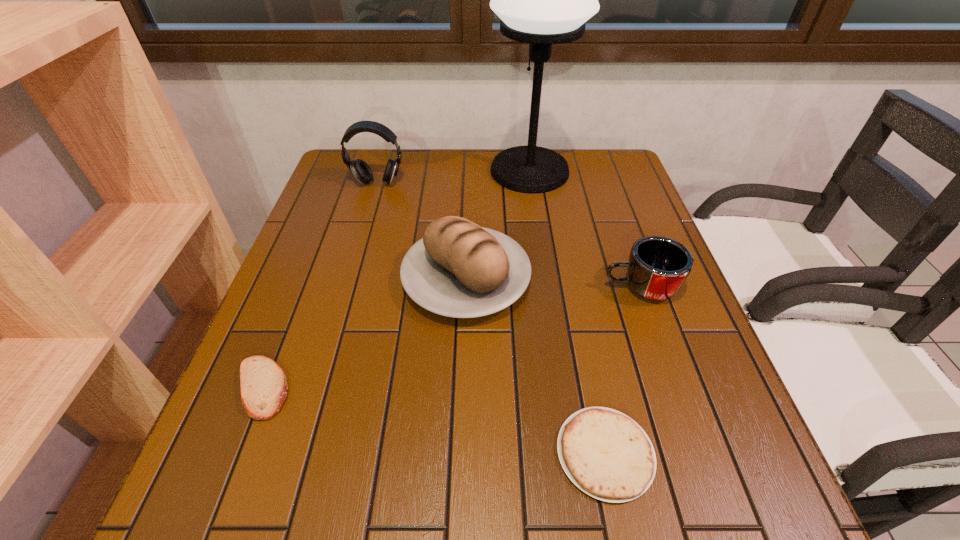
Locate an element on the screen. This screenshot has height=540, width=960. object present at the far left corner is located at coordinates (361, 170).

Locate an element on the screen. The height and width of the screenshot is (540, 960). vacant space at the far edge is located at coordinates (474, 165).

Find the location of a particular element. The width and height of the screenshot is (960, 540). free space at the near edge of the desktop is located at coordinates (585, 499).

In the image, there is a desktop. Where is `vacant space at the left edge`? This screenshot has height=540, width=960. vacant space at the left edge is located at coordinates (325, 242).

Locate an element on the screen. This screenshot has width=960, height=540. vacant space at the right edge of the desktop is located at coordinates 710,395.

Image resolution: width=960 pixels, height=540 pixels. What are the coordinates of `vacant point at the near left corner` in the screenshot? It's located at (249, 515).

At what (x,y) coordinates should I click in order to perform the action: click on blank region between the tortilla and the earphone. Please return your answer as a coordinate pair (x, y). Looking at the image, I should click on (492, 318).

Image resolution: width=960 pixels, height=540 pixels. I want to click on empty space between the tallest object and the second tallest object, so click(453, 177).

You are a GUI agent. You are given a task and a screenshot of the screen. Output one action in this format:
    pyautogui.click(x=<x>, y=<y>)
    Task: Click on the empty location between the tortilla and the pita bread
    The width and height of the screenshot is (960, 540).
    Given the screenshot: What is the action you would take?
    pyautogui.click(x=434, y=421)

Where is `empty space that is in between the fourth tallest object and the second tallest object`? The image size is (960, 540). empty space that is in between the fourth tallest object and the second tallest object is located at coordinates (509, 235).